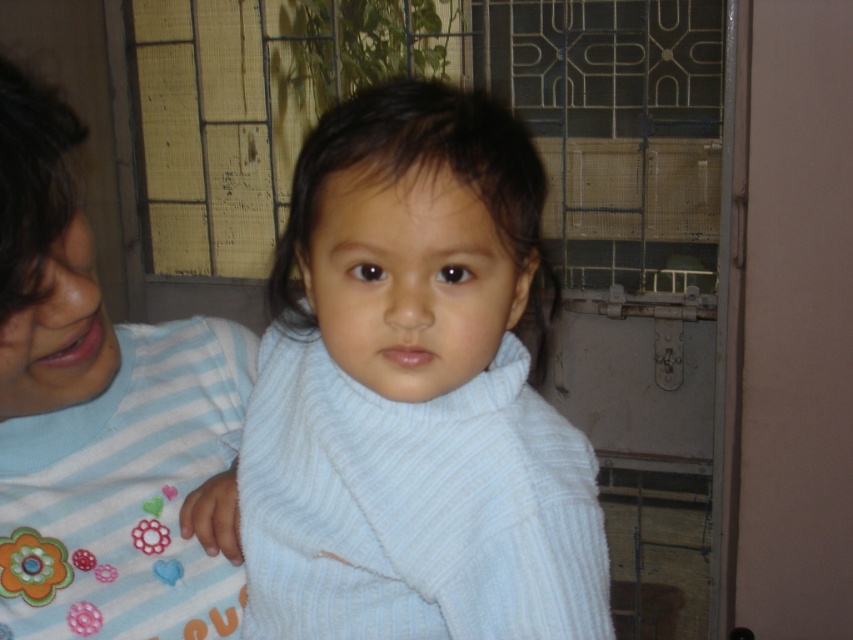
You are designing a play area for children and need to place two chairs. One chair is for the child wearing the light blue ribbed sweater at center and the other for the child in the blue striped shirt at left. If the chairs must be placed according to the width of their clothing to ensure comfort, which chair should be wider?

The chair for the light blue ribbed sweater at center should be wider because the light blue ribbed sweater at center might be wider than the blue striped shirt at left.